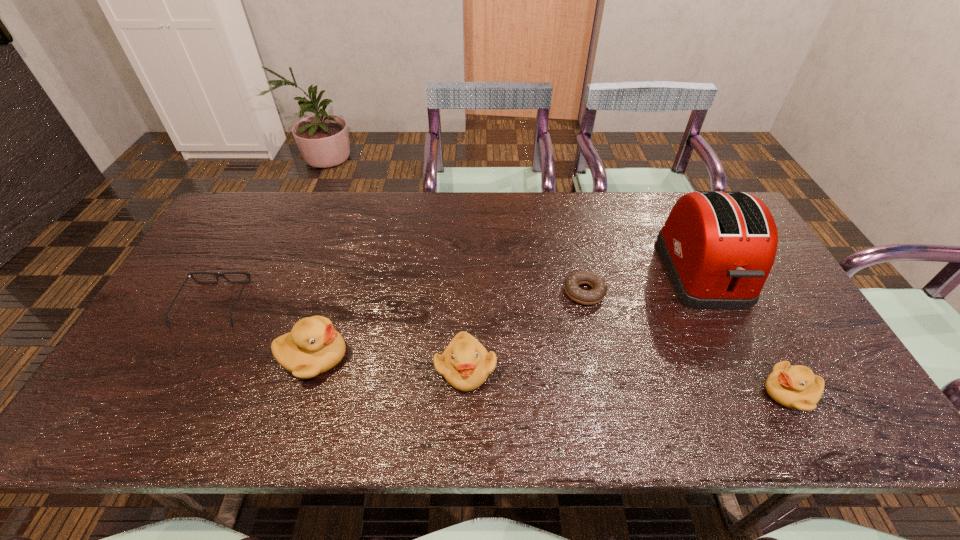
You are a GUI agent. You are given a task and a screenshot of the screen. Output one action in this format:
    pyautogui.click(x=<x>, y=<y>)
    Task: Click on the vacant space that is in between the leftmost duckling and the second duckling from right to left
    This screenshot has height=540, width=960.
    Given the screenshot: What is the action you would take?
    click(390, 362)

Locate an element on the screen. The image size is (960, 540). free spot between the tallest object and the fourth tallest object is located at coordinates (746, 333).

This screenshot has height=540, width=960. I want to click on free space between the spectacles and the doughnut, so click(398, 298).

Identify the location of empty space that is in between the leftmost object and the doughnut. (398, 298).

This screenshot has width=960, height=540. Find the location of `vacant area that lies between the doughnut and the third tallest object`. vacant area that lies between the doughnut and the third tallest object is located at coordinates (525, 330).

The height and width of the screenshot is (540, 960). In order to click on free spot between the leftmost object and the tallest object in this screenshot , I will do `click(458, 288)`.

The height and width of the screenshot is (540, 960). What are the coordinates of `the fourth closest object to the doughnut` in the screenshot? It's located at (314, 346).

Where is `object that is the closest to the rightmost duckling`? This screenshot has width=960, height=540. object that is the closest to the rightmost duckling is located at coordinates (718, 247).

Where is `the second closest duckling to the second object from left to right`? This screenshot has width=960, height=540. the second closest duckling to the second object from left to right is located at coordinates (796, 387).

Select which duckling is the second closest to the shortest duckling. Please provide its 2D coordinates. Your answer should be formatted as a tuple, i.e. [(x, y)], where the tuple contains the x and y coordinates of a point satisfying the conditions above.

[(314, 346)]